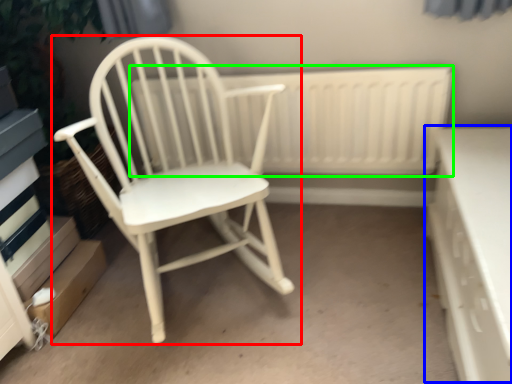
Question: Which object is the farthest from chair (highlighted by a red box)? Choose among these: table (highlighted by a blue box) or radiator (highlighted by a green box).

Choices:
 (A) table
 (B) radiator

Answer: (A)